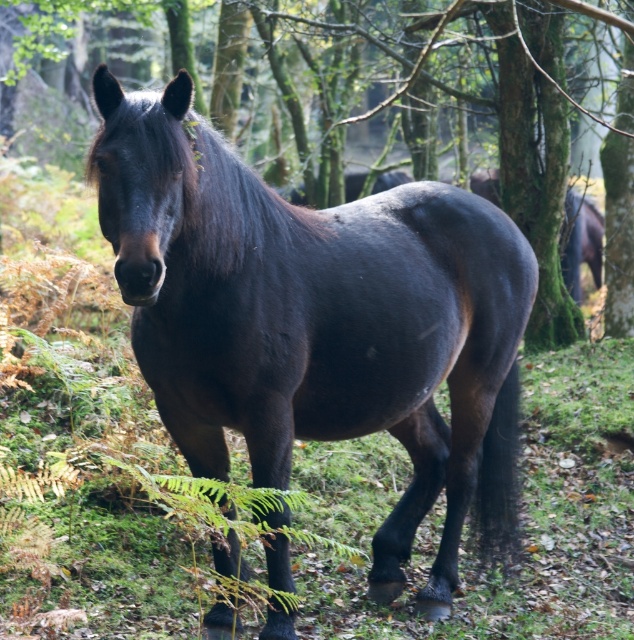
Is shiny dark brown horse at center shorter than shiny dark brown horse at right?

Incorrect, shiny dark brown horse at center's height does not fall short of shiny dark brown horse at right's.

Describe the element at coordinates (318, 321) in the screenshot. The image size is (634, 640). I see `shiny dark brown horse at center` at that location.

Does point (453, 531) come closer to viewer compared to point (576, 244)?

Yes, it is in front of point (576, 244).

I want to click on shiny dark brown horse at center, so click(318, 321).

Can you confirm if green mossy tree at center is shorter than shiny dark brown horse at right?

No, green mossy tree at center is not shorter than shiny dark brown horse at right.

Which is in front, point (619, 237) or point (592, 266)?

Point (619, 237)

Locate an element on the screen. The width and height of the screenshot is (634, 640). green mossy tree at center is located at coordinates (522, 140).

Between shiny dark brown horse at center and green mossy tree at center, which one has more height?

green mossy tree at center

Can you confirm if shiny dark brown horse at center is thinner than green mossy tree at center?

Yes.

Is point (228, 282) more distant than point (526, 80)?

No, it is in front of (526, 80).

Identify the location of shiny dark brown horse at center. The image size is (634, 640). (318, 321).